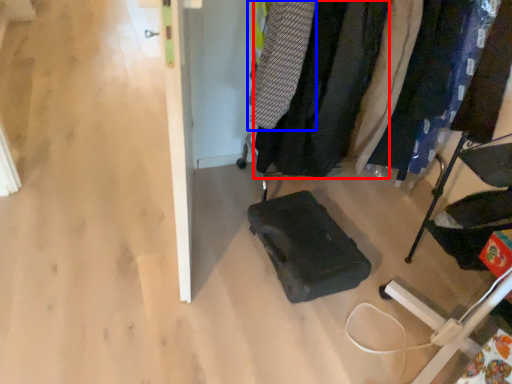
Question: Which object is closer to the camera taking this photo, clothing (highlighted by a red box) or clothing (highlighted by a blue box)?

Choices:
 (A) clothing
 (B) clothing

Answer: (B)